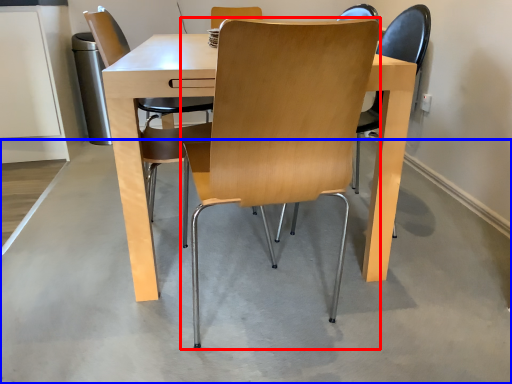
Question: Among these objects, which one is nearest to the camera, chair (highlighted by a red box) or concrete (highlighted by a blue box)?

Choices:
 (A) chair
 (B) concrete

Answer: (A)